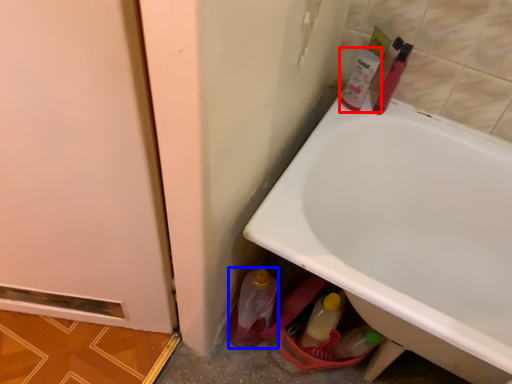
Question: Among these objects, which one is farthest to the camera, mouthwash (highlighted by a red box) or bottle (highlighted by a blue box)?

Choices:
 (A) mouthwash
 (B) bottle

Answer: (A)